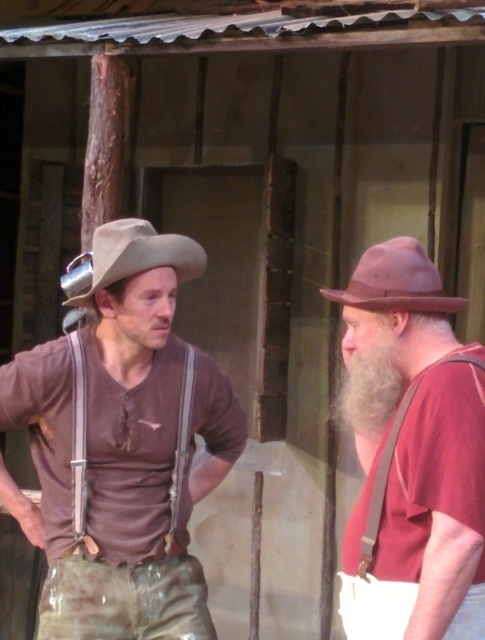
You are an observer standing in front of the rustic wooden structure. You notice two people. The person on the left is wearing a light brown cowboy hat and dark brown shirt, while the person on the right is wearing a reddish brown shirt and hat. Which person is wearing the brown leather suspenders at right?

The person on the right is wearing the brown leather suspenders at right.

You are a photographer who needs to capture a portrait of both individuals in the matte brown shirt at left and the other person. The camera you are using has a maximum focus range of 6 feet. Can you take a photo that includes both of them clearly?

The individuals are 6.58 feet apart, which exceeds the camera maximum focus range of 6 feet. Therefore, you cannot take a photo that includes both clearly.

You are an observer at the scene. You notice the pink felt hat at right and the brown fabric suspenders at left. Which object is larger in size?

The brown fabric suspenders at left are larger than the pink felt hat at right.